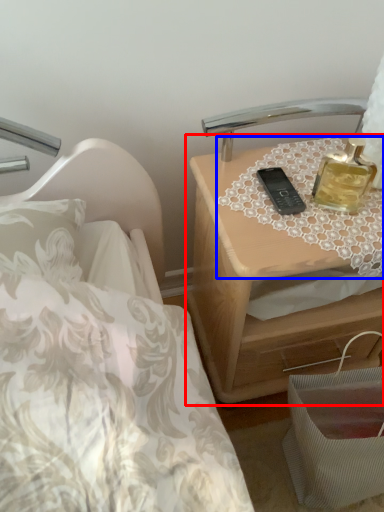
Question: Which object is closer to the camera taking this photo, nightstand (highlighted by a red box) or tablecloth (highlighted by a blue box)?

Choices:
 (A) nightstand
 (B) tablecloth

Answer: (B)